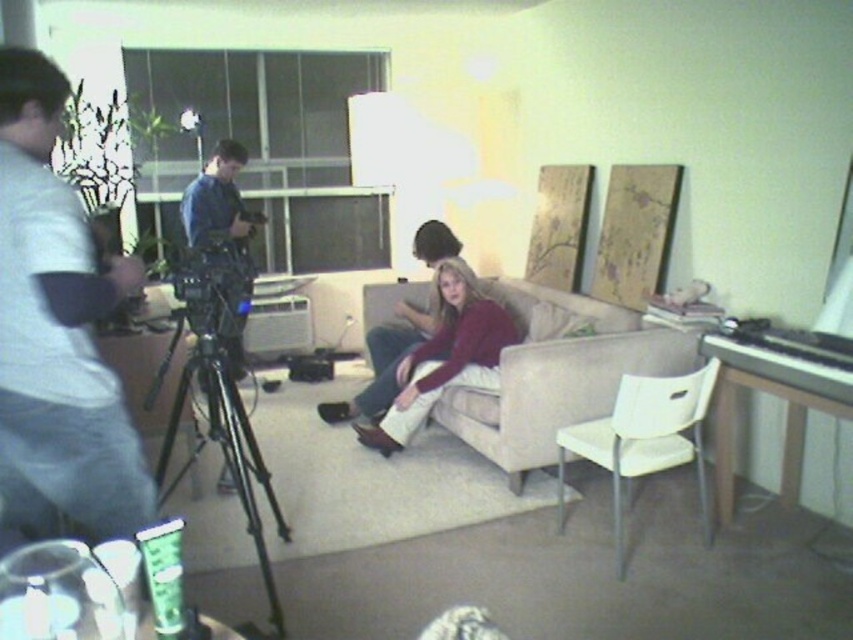
You are setting up a video call and need to place a laptop between the white plastic chair at center and the black polished piano at right. Which object should the laptop be closer to if you want it to be near the larger object?

The white plastic chair at center is larger than the black polished piano at right, so the laptop should be placed closer to the white plastic chair at center.

You are a camera operator in the scene and need to adjust the camera focus. The beige fabric couch at center and the blue denim shirt at center are both in the frame. Which object is closer to the camera?

The beige fabric couch at center and blue denim shirt at center are 6.29 feet apart from each other. Since the distance between them is given, but their exact positions relative to the camera aren

In the scene shown: You are a fashion stylist preparing for a photoshoot and need to arrange two garments in the scene. The gray cotton shirt at left and the matte burgundy sweater at center are already placed. Which garment is positioned to the right side of the other?

The matte burgundy sweater at center is positioned to the right of the gray cotton shirt at left.